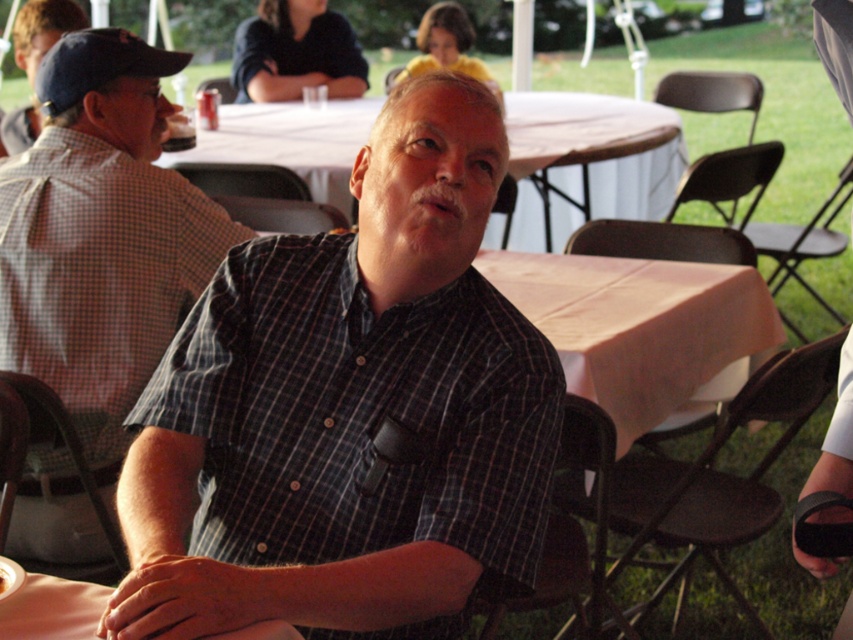
You are a photographer taking a picture of the plaid shirt at center and the brown crumbly bread at center. Which object should you focus on first to ensure both are in sharp focus?

The plaid shirt at center is closer to the viewer than the brown crumbly bread at center. To ensure both are in sharp focus, you should focus on the plaid shirt at center first, as it is the closer object.

You are organizing a clothing display and need to arrange the plaid shirt at center and the matte plaid shirt at left based on their widths. Which shirt should be placed on the left side of the display to ensure proper arrangement?

The matte plaid shirt at left should be placed on the left side of the display since it is wider than the plaid shirt at center.